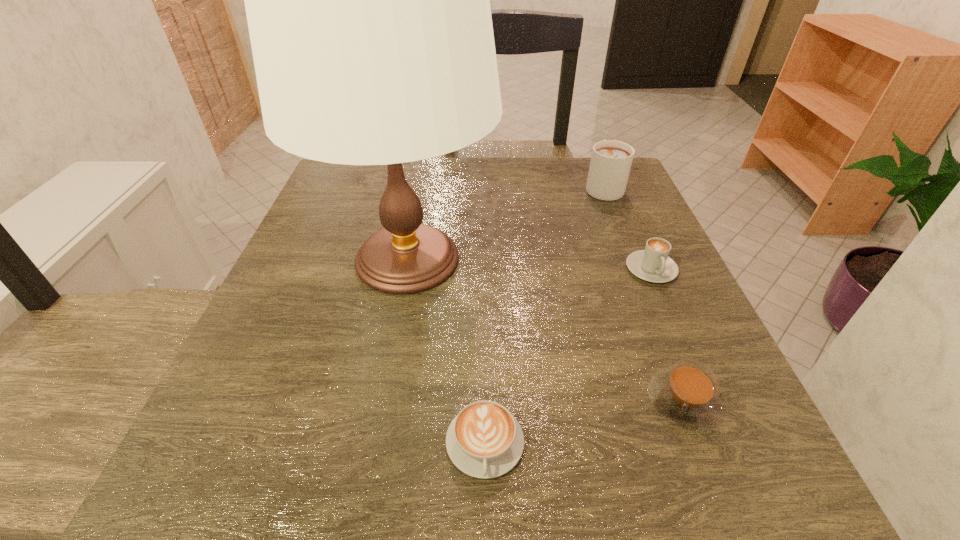
Where is `free spot located to the right of the second farthest cappuccino`? free spot located to the right of the second farthest cappuccino is located at coordinates (745, 483).

Where is `object at the far edge`? Image resolution: width=960 pixels, height=540 pixels. object at the far edge is located at coordinates (611, 160).

You are a GUI agent. You are given a task and a screenshot of the screen. Output one action in this format:
    pyautogui.click(x=<x>, y=<y>)
    Task: Click on the object that is at the near edge
    
    Given the screenshot: What is the action you would take?
    pyautogui.click(x=484, y=440)

Where is `object at the left edge`? This screenshot has width=960, height=540. object at the left edge is located at coordinates (367, 0).

Where is `object that is at the far right corner`? Image resolution: width=960 pixels, height=540 pixels. object that is at the far right corner is located at coordinates (611, 160).

Where is `vacant space at the far edge`? vacant space at the far edge is located at coordinates (513, 197).

Find the location of a particular element. vacant space at the left edge of the desktop is located at coordinates (342, 289).

I want to click on vacant space at the right edge of the desktop, so (709, 437).

Find the location of a particular element. The width and height of the screenshot is (960, 540). free space at the far left corner of the desktop is located at coordinates (368, 197).

In the image, there is a desktop. In order to click on blank space at the near left corner in this screenshot , I will do `click(246, 456)`.